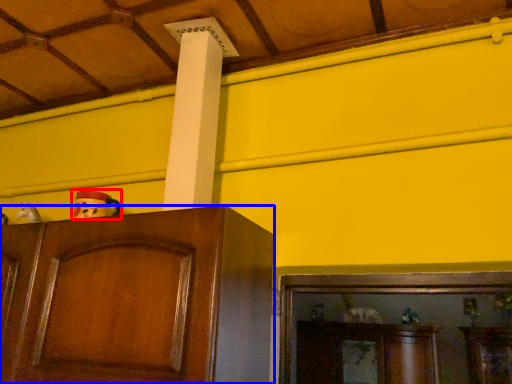
Question: Among these objects, which one is nearest to the camera, toy (highlighted by a red box) or cabinetry (highlighted by a blue box)?

Choices:
 (A) toy
 (B) cabinetry

Answer: (B)